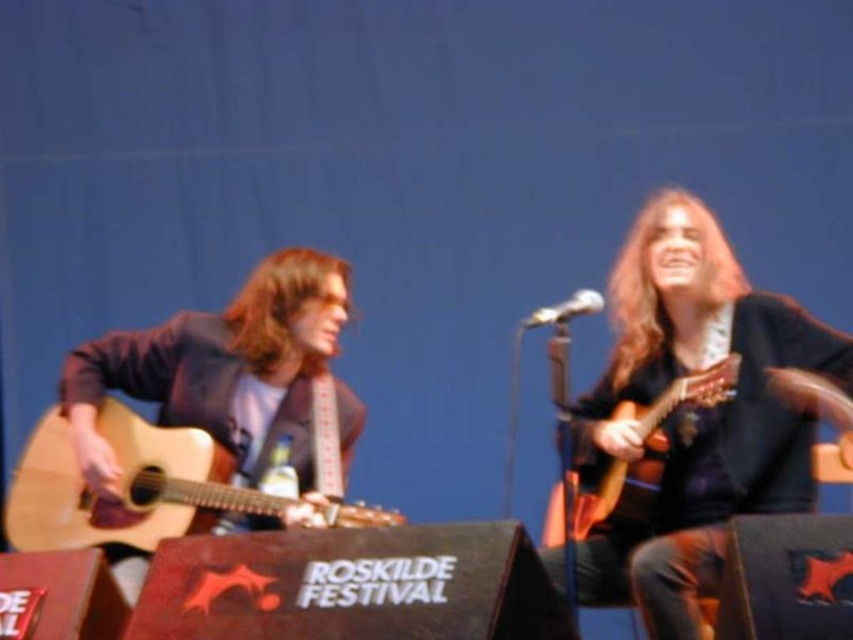
Question: Which object appears closest to the camera in this image?

Choices:
 (A) matte brown guitar at left
 (B) matte black guitar at right
 (C) metallic silver microphone at center
 (D) natural wood acoustic guitar at left

Answer: (D)

Question: Which object is the closest to the metallic silver microphone at center?

Choices:
 (A) matte black guitar at right
 (B) natural wood acoustic guitar at left

Answer: (A)

Question: Does wooden acoustic guitar at right come behind metallic silver microphone at center?

Choices:
 (A) yes
 (B) no

Answer: (A)

Question: Which point is farther to the camera?

Choices:
 (A) (529, 326)
 (B) (602, 472)
 (C) (190, 385)

Answer: (C)

Question: Is matte black guitar at right positioned in front of metallic silver microphone at center?

Choices:
 (A) no
 (B) yes

Answer: (B)

Question: Can you confirm if natural wood acoustic guitar at left is wider than metallic silver microphone at center?

Choices:
 (A) no
 (B) yes

Answer: (B)